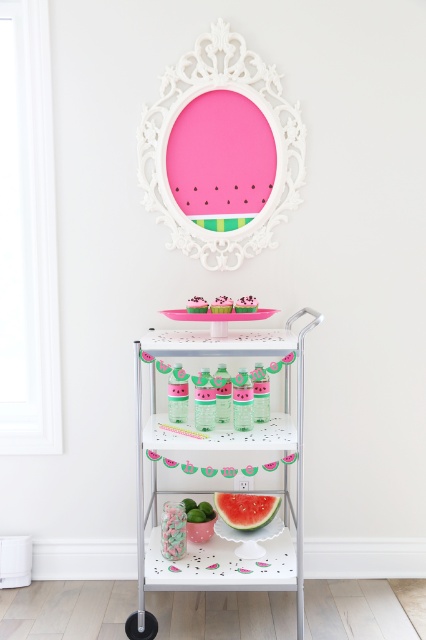
You are standing in front of the bar cart and want to place a 10 cm tall watermelon matte at lower center on the top shelf. Can you determine if there is enough vertical space between the top shelf and the decorative pink oval mirror to accommodate it?

The watermelon matte at lower center is 8.57 feet away from the viewer, but the vertical space between the top shelf and the decorative pink oval mirror isn

You are organizing a summer party and want to place both the watermelon matte at lower center and the green matte lime at lower center on a shelf. Which one should you place first to ensure they both fit?

The watermelon matte at lower center might be wider than green matte lime at lower center, so you should place the wider one first to ensure both fit on the shelf.

You are arranging a summer party and see the watermelon matte at lower center and the green matte lime at lower center on the bar cart. Which one is located to the right of the other?

The watermelon matte at lower center is positioned on the right side of green matte lime at lower center.